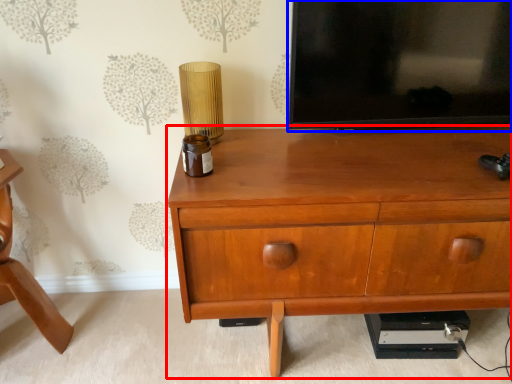
Question: Which object appears closest to the camera in this image, chest of drawers (highlighted by a red box) or television (highlighted by a blue box)?

Choices:
 (A) chest of drawers
 (B) television

Answer: (A)